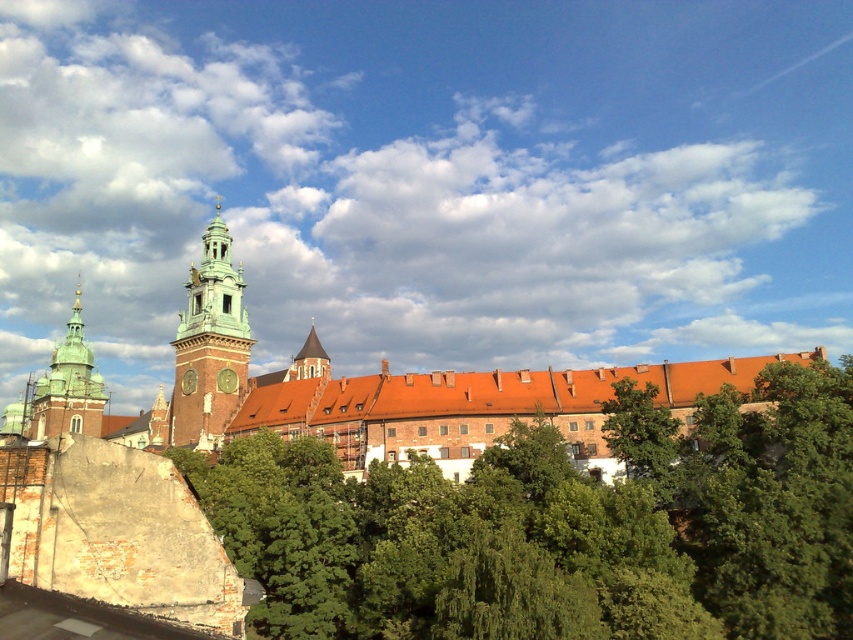
Can you confirm if white fluffy cloud at upper center is taller than green stone tower at center-left?

Indeed, white fluffy cloud at upper center has a greater height compared to green stone tower at center-left.

Between white fluffy cloud at upper center and green stone tower at center-left, which one appears on the right side from the viewer's perspective?

From the viewer's perspective, white fluffy cloud at upper center appears more on the right side.

The image size is (853, 640). In order to click on white fluffy cloud at upper center in this screenshot , I will do `click(430, 177)`.

Is white fluffy cloud at upper center thinner than green leafy tree at center?

In fact, white fluffy cloud at upper center might be wider than green leafy tree at center.

Which is in front, point (36, 352) or point (798, 464)?

Point (798, 464) is in front.

This screenshot has height=640, width=853. In order to click on white fluffy cloud at upper center in this screenshot , I will do `click(430, 177)`.

From the picture: Which of these two, green leafy tree at center or green stone tower at center-left, stands shorter?

With less height is green leafy tree at center.

Which is behind, point (697, 452) or point (242, 289)?

The point (242, 289) is behind.

Describe the element at coordinates (561, 525) in the screenshot. I see `green leafy tree at center` at that location.

The width and height of the screenshot is (853, 640). I want to click on green leafy tree at center, so click(561, 525).